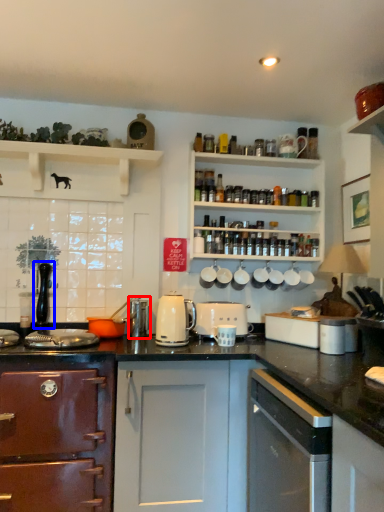
Question: Which of the following is the closest to the observer, appliance (highlighted by a red box) or faucet (highlighted by a blue box)?

Choices:
 (A) appliance
 (B) faucet

Answer: (A)